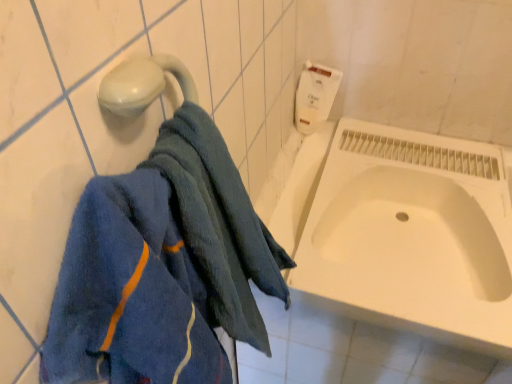
The image size is (512, 384). Find the location of `free space in front of white matte toilet paper at upper right`. free space in front of white matte toilet paper at upper right is located at coordinates (330, 163).